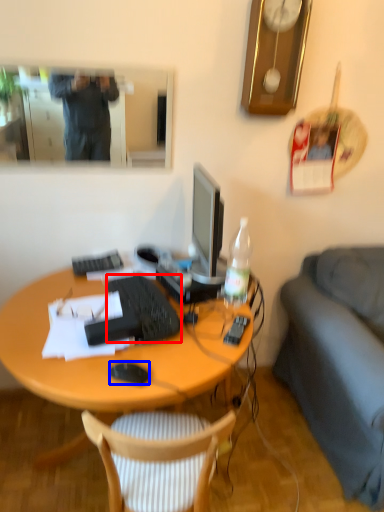
Question: Which object appears closest to the camera in this image, computer keyboard (highlighted by a red box) or computer mouse (highlighted by a blue box)?

Choices:
 (A) computer keyboard
 (B) computer mouse

Answer: (B)